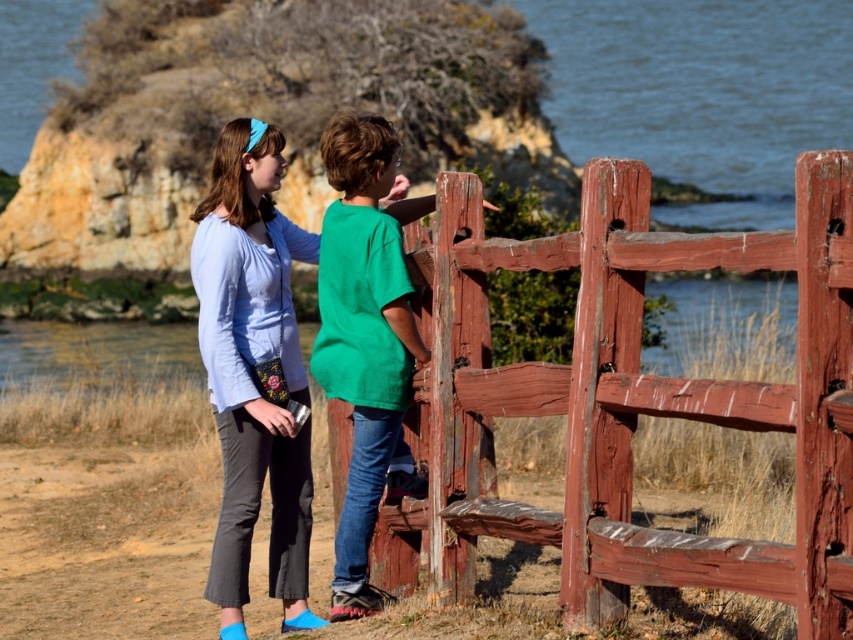
You are trying to decide which of the two shirts in the image is wider. You see the matte blue shirt at center and the green matte shirt at center. Which one has a smaller width?

The matte blue shirt at center has a smaller width than the green matte shirt at center according to the description.

You are a photographer trying to capture a landscape shot of the smooth water at upper center and the green matte shirt at center. Which object will appear larger in your photo if you keep the camera at the same distance?

The smooth water at upper center will appear larger in the photo because it is taller than the green matte shirt at center.

You are a photographer trying to capture a clear shot of the green matte shirt at center without the smooth water at upper center obstructing the view. Is there a way to adjust your position to achieve this?

The smooth water at upper center is positioned over the green matte shirt at center. To avoid obstruction, move your camera position below the level of the green matte shirt at center so the water no longer blocks the view.